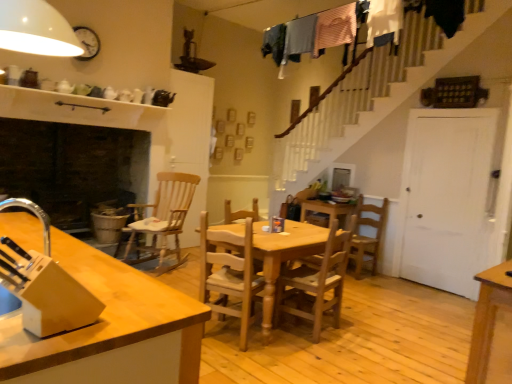
In order to click on free space in front of wooden chair at center, arranged as the 2th chair when viewed from the right in this screenshot , I will do `click(318, 355)`.